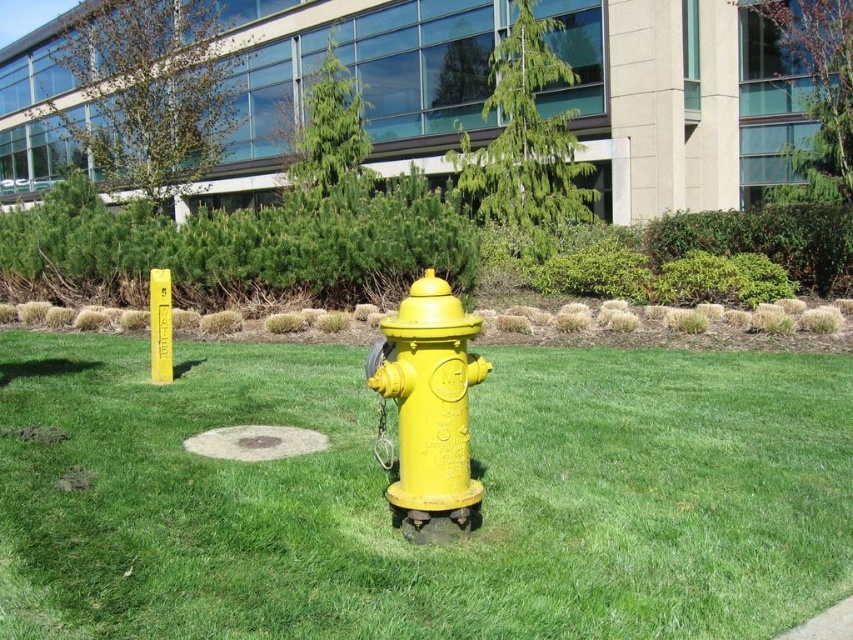
Question: Which object is farther from the camera taking this photo?

Choices:
 (A) gray concrete sidewalk at lower right
 (B) grassy concrete at center
 (C) green grass at center

Answer: (B)

Question: From the image, what is the correct spatial relationship of yellow matte pole at center in relation to gray concrete sidewalk at lower right?

Choices:
 (A) left
 (B) right

Answer: (A)

Question: Is yellow matte fire hydrant at center positioned in front of grassy concrete at center?

Choices:
 (A) no
 (B) yes

Answer: (B)

Question: Which point is closer to the camera?

Choices:
 (A) (233, 452)
 (B) (840, 605)
 (C) (158, 330)
 (D) (393, 493)

Answer: (B)

Question: Does green grass at center have a lesser width compared to gray concrete sidewalk at lower right?

Choices:
 (A) no
 (B) yes

Answer: (B)

Question: Which object appears closest to the camera in this image?

Choices:
 (A) green grass at center
 (B) yellow matte fire hydrant at center
 (C) yellow matte pole at center
 (D) grassy concrete at center

Answer: (A)